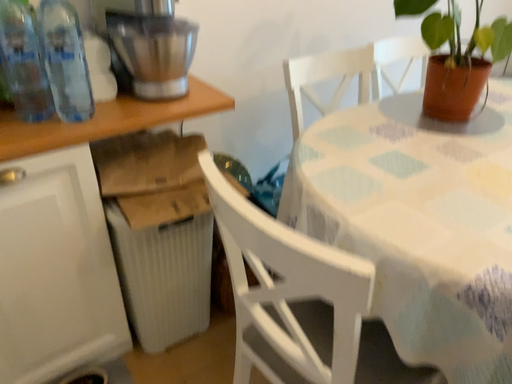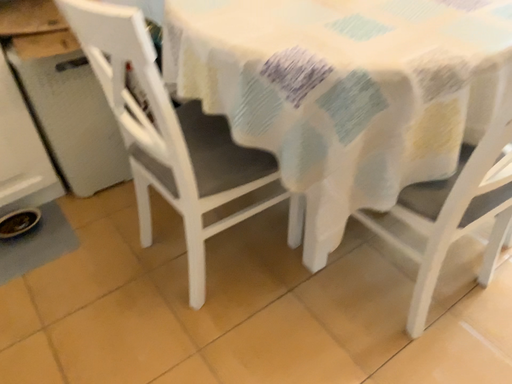
Question: How did the camera likely rotate when shooting the video?

Choices:
 (A) rotated upward
 (B) rotated downward

Answer: (B)